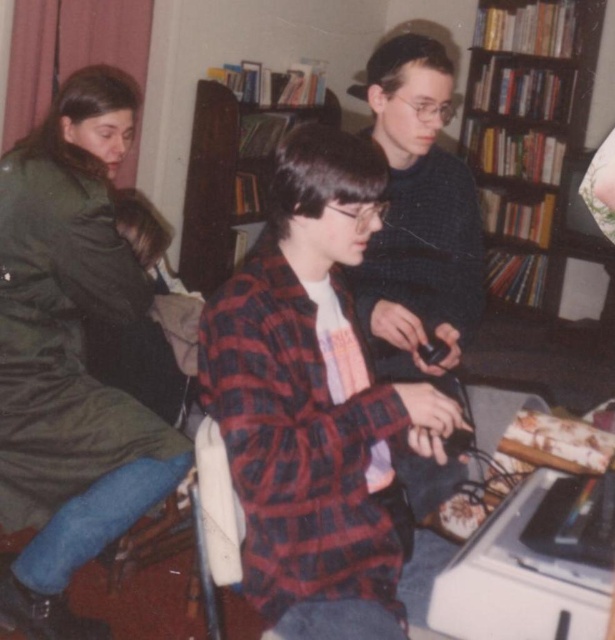
In the image, there is a dark brown wooden bookshelf at upper right located at point (531, 147). A small toy car is placed at point 0.300, 0.750. Which object is closer to the center of the image?

The dark brown wooden bookshelf at upper right at point (531, 147) is closer to the center of the image than the small toy car at point 0.300, 0.750.

You are a robot with a 1.2 meter arm. You need to reach the red plaid shirt at center to hand over a document. Can your arm reach it from your current position?

The red plaid shirt at center is 1.12 meters away from the camera, so yes, the robot can reach it with its 1.2 meter arm.